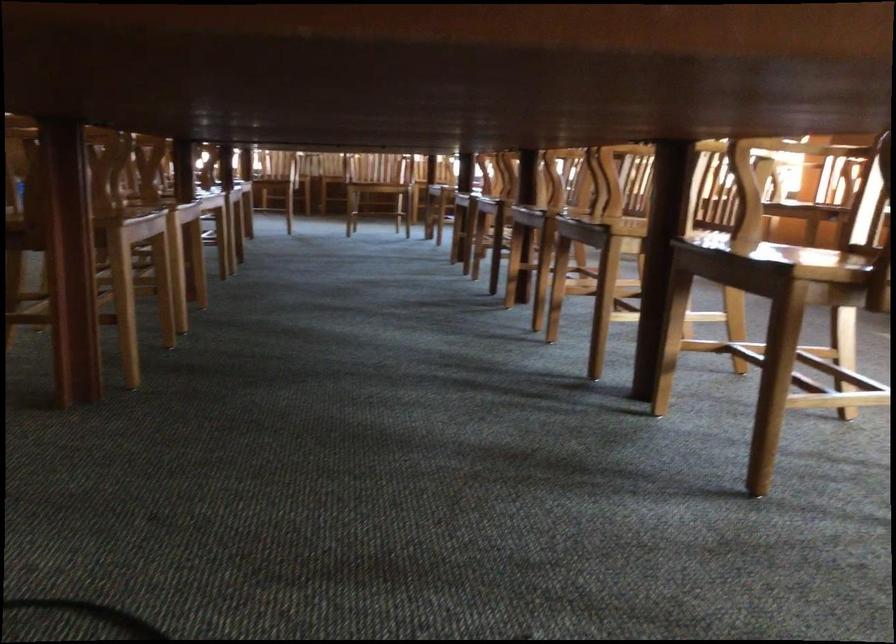
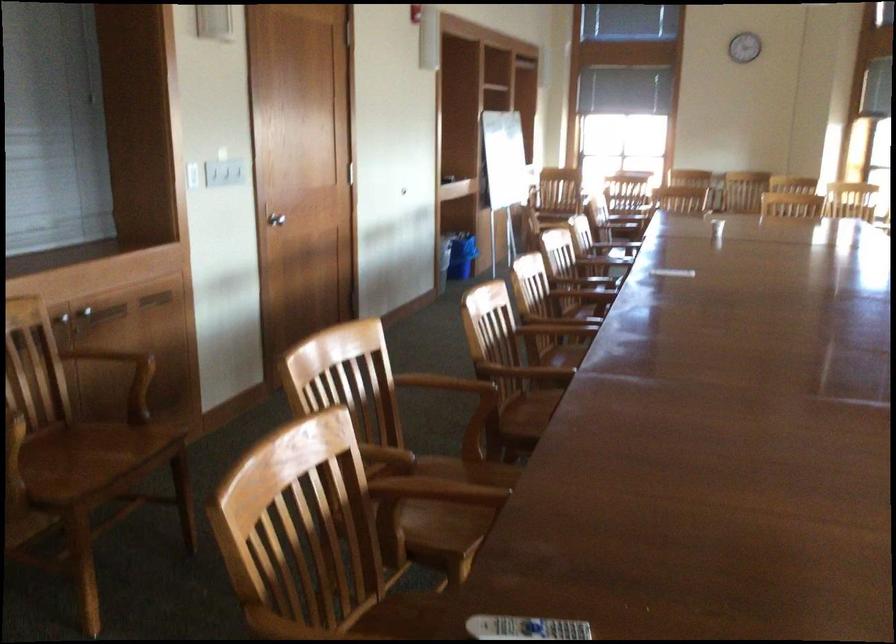
Question: I am providing you with two images of the same scene from different viewpoints. Please identify which objects are invisible in image2.

Choices:
 (A) blue trash can
 (B) chair sitting surface
 (C) wooden chair sitting surface
 (D) black panel handle

Answer: (B)